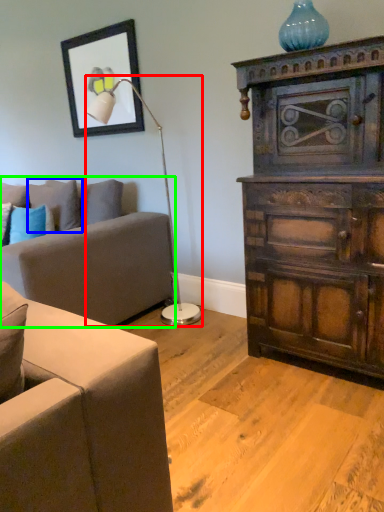
Question: Which is nearer to the table lamp (highlighted by a red box)? pillow (highlighted by a blue box) or studio couch (highlighted by a green box).

Choices:
 (A) pillow
 (B) studio couch

Answer: (B)